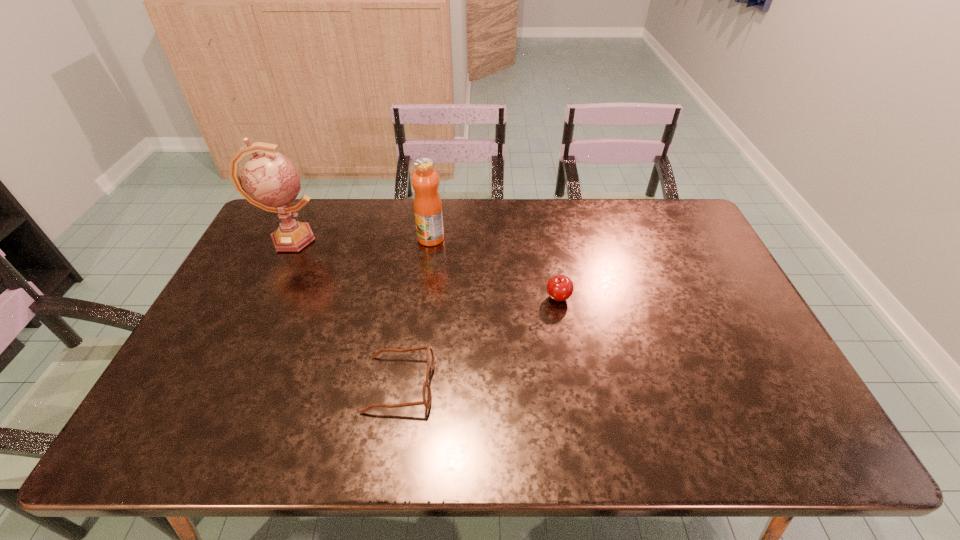
Identify which object is located as the third nearest to the spectacles. Please provide its 2D coordinates. Your answer should be formatted as a tuple, i.e. [(x, y)], where the tuple contains the x and y coordinates of a point satisfying the conditions above.

[(269, 180)]

Where is `free space in the image that satisfies the following two spatial constraints: 1. on the front-facing side of the rightmost object; 2. on the left side of the tallest object`? The height and width of the screenshot is (540, 960). free space in the image that satisfies the following two spatial constraints: 1. on the front-facing side of the rightmost object; 2. on the left side of the tallest object is located at coordinates (261, 298).

Find the location of a particular element. vacant area that satisfies the following two spatial constraints: 1. on the back side of the rightmost object; 2. on the front-facing side of the globe is located at coordinates (546, 239).

At what (x,y) coordinates should I click in order to perform the action: click on vacant space that satisfies the following two spatial constraints: 1. on the front side of the third shortest object; 2. on the front-facing side of the leftmost object. Please return your answer as a coordinate pair (x, y). Looking at the image, I should click on (431, 239).

Locate an element on the screen. blank area in the image that satisfies the following two spatial constraints: 1. on the front-facing side of the tallest object; 2. on the right side of the second shortest object is located at coordinates (261, 298).

You are a GUI agent. You are given a task and a screenshot of the screen. Output one action in this format:
    pyautogui.click(x=<x>, y=<y>)
    Task: Click on the free spot that satisfies the following two spatial constraints: 1. on the back side of the cherry; 2. on the front-facing side of the globe
    
    Given the screenshot: What is the action you would take?
    pyautogui.click(x=546, y=239)